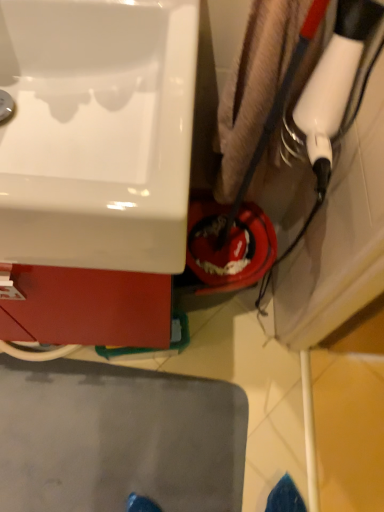
Locate an element on the screen. This screenshot has height=512, width=384. white glossy sink at upper left is located at coordinates (97, 133).

The image size is (384, 512). Describe the element at coordinates (97, 133) in the screenshot. I see `white glossy sink at upper left` at that location.

At what (x,y) coordinates should I click in order to perform the action: click on white glossy sink at upper left. Please return your answer as a coordinate pair (x, y). This screenshot has width=384, height=512. Looking at the image, I should click on (97, 133).